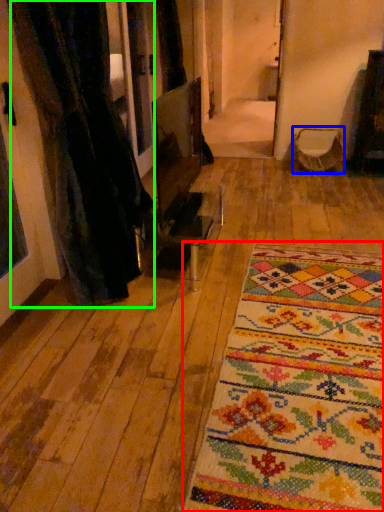
Question: Based on their relative distances, which object is nearer to mat (highlighted by a red box)? Choose from armchair (highlighted by a blue box) and curtain (highlighted by a green box).

Choices:
 (A) armchair
 (B) curtain

Answer: (B)